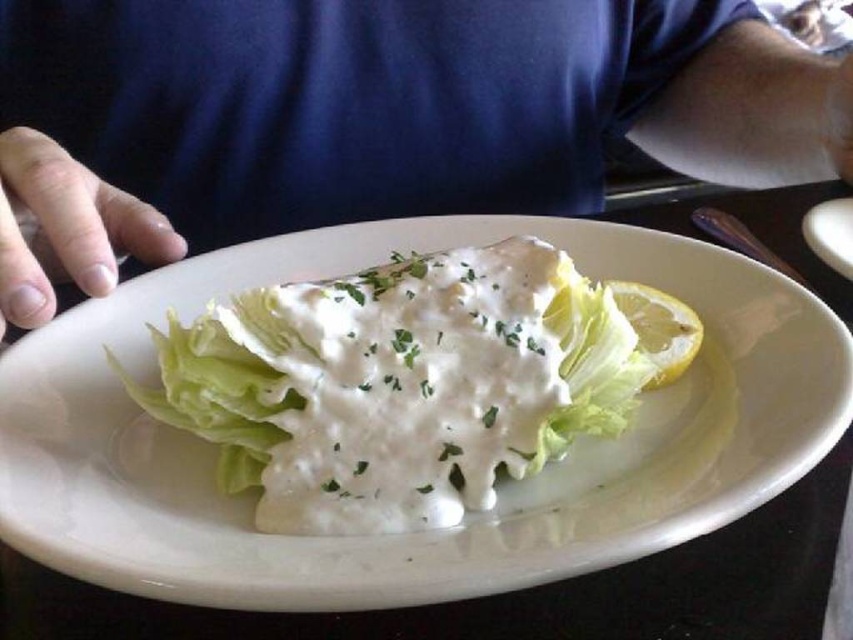
What is the 2D coordinate of the blue fabric shirt at upper center in the image?

The 2D coordinate of the blue fabric shirt at upper center is at point [419,104].

You are a food critic sitting at a table and looking at the plate with the blue fabric shirt at upper center and the green leafy lettuce at center. Which object is closer to you?

The blue fabric shirt at upper center is closer to you because it is further to the viewer than the green leafy lettuce at center.